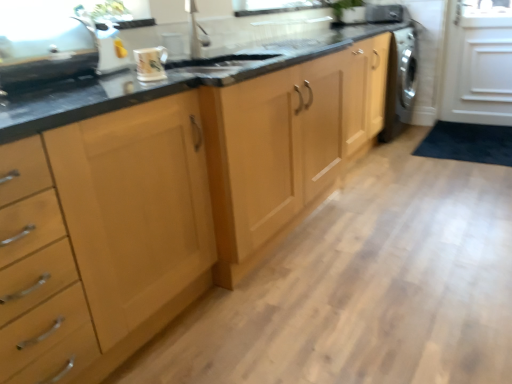
Measure the distance between satin silver dishwasher at right, which is counted as the 1th appliance, starting from the back, and camera.

satin silver dishwasher at right, which is counted as the 1th appliance, starting from the back, and camera are 3.54 meters apart from each other.

You are a GUI agent. You are given a task and a screenshot of the screen. Output one action in this format:
    pyautogui.click(x=<x>, y=<y>)
    Task: Click on the green leafy plant at upper center
    The image size is (512, 384).
    Given the screenshot: What is the action you would take?
    pyautogui.click(x=341, y=8)

What are the coordinates of `metallic silver kettle at upper left, placed as the 2th appliance when sorted from left to right` in the screenshot? It's located at (108, 48).

The width and height of the screenshot is (512, 384). Find the location of `satin silver dishwasher at right, which is counted as the 1th appliance, starting from the top`. satin silver dishwasher at right, which is counted as the 1th appliance, starting from the top is located at coordinates (384, 13).

Who is taller, metallic silver kettle at upper left, placed as the 2th appliance when sorted from left to right, or satin silver sink at upper left, which is the third appliance in right-to-left order?

metallic silver kettle at upper left, placed as the 2th appliance when sorted from left to right.

Where is `appliance lying on the left of metallic silver kettle at upper left, which is counted as the 2th appliance, starting from the back`? The height and width of the screenshot is (384, 512). appliance lying on the left of metallic silver kettle at upper left, which is counted as the 2th appliance, starting from the back is located at coordinates (46, 52).

From a real-world perspective, is metallic silver kettle at upper left, the 2th appliance in the bottom-to-top sequence, physically located above or below satin silver sink at upper left, placed as the third appliance when sorted from top to bottom?

metallic silver kettle at upper left, the 2th appliance in the bottom-to-top sequence, is above satin silver sink at upper left, placed as the third appliance when sorted from top to bottom.

Between metallic silver kettle at upper left, the 2th appliance in the top-to-bottom sequence, and satin silver sink at upper left, the 1th appliance when ordered from bottom to top, which one has larger size?

Bigger between the two is satin silver sink at upper left, the 1th appliance when ordered from bottom to top.

Are glossy ceramic mug at upper center and satin silver sink at upper left, which appears as the 1th appliance when viewed from the left, far apart?

No, there isn't a large distance between glossy ceramic mug at upper center and satin silver sink at upper left, which appears as the 1th appliance when viewed from the left.

Can you tell me how much glossy ceramic mug at upper center and satin silver sink at upper left, the 1th appliance when ordered from bottom to top, differ in facing direction?

The angular difference between glossy ceramic mug at upper center and satin silver sink at upper left, the 1th appliance when ordered from bottom to top, is 0.985 degrees.

From a real-world perspective, is glossy ceramic mug at upper center positioned above or below satin silver sink at upper left, which is the third appliance in right-to-left order?

In terms of real-world spatial position, glossy ceramic mug at upper center is below satin silver sink at upper left, which is the third appliance in right-to-left order.

Can you confirm if glossy ceramic mug at upper center is wider than satin silver sink at upper left, the 1th appliance when ordered from bottom to top?

Incorrect, the width of glossy ceramic mug at upper center does not surpass that of satin silver sink at upper left, the 1th appliance when ordered from bottom to top.

Which object is positioned more to the right, glossy ceramic mug at upper center or satin silver dishwasher at right, which is counted as the 1th appliance, starting from the top?

satin silver dishwasher at right, which is counted as the 1th appliance, starting from the top, is more to the right.

Is glossy ceramic mug at upper center looking in the opposite direction of satin silver dishwasher at right, which ranks as the 1th appliance in right-to-left order?

No, glossy ceramic mug at upper center is not facing the opposite direction of satin silver dishwasher at right, which ranks as the 1th appliance in right-to-left order.

Which is further, (158, 78) or (369, 8)?

The point (369, 8) is farther from the camera.

Between glossy ceramic mug at upper center and satin silver dishwasher at right, which is counted as the 1th appliance, starting from the top, which one has smaller size?

With smaller size is glossy ceramic mug at upper center.

Is satin silver sink at upper left, placed as the third appliance when sorted from top to bottom, aimed at green leafy plant at upper center?

No, satin silver sink at upper left, placed as the third appliance when sorted from top to bottom, is not facing towards green leafy plant at upper center.

From the picture: Can you tell me how much satin silver sink at upper left, the 1th appliance when ordered from bottom to top, and green leafy plant at upper center differ in facing direction?

The angle between the facing direction of satin silver sink at upper left, the 1th appliance when ordered from bottom to top, and the facing direction of green leafy plant at upper center is 41.6 degrees.

From a real-world perspective, is satin silver sink at upper left, the 1th appliance when ordered from bottom to top, beneath green leafy plant at upper center?

Incorrect, from a real-world perspective, satin silver sink at upper left, the 1th appliance when ordered from bottom to top, is higher than green leafy plant at upper center.

Considering the relative positions of satin silver sink at upper left, which appears as the 1th appliance when viewed from the left, and green leafy plant at upper center in the image provided, is satin silver sink at upper left, which appears as the 1th appliance when viewed from the left, to the left or to the right of green leafy plant at upper center?

Based on their positions, satin silver sink at upper left, which appears as the 1th appliance when viewed from the left, is located to the left of green leafy plant at upper center.

Which is more to the left, satin silver sink at upper left, placed as the third appliance when sorted from top to bottom, or glossy ceramic mug at upper center?

satin silver sink at upper left, placed as the third appliance when sorted from top to bottom, is more to the left.

Considering the relative sizes of satin silver sink at upper left, which appears as the 1th appliance when viewed from the left, and glossy ceramic mug at upper center in the image provided, is satin silver sink at upper left, which appears as the 1th appliance when viewed from the left, bigger than glossy ceramic mug at upper center?

Yes, satin silver sink at upper left, which appears as the 1th appliance when viewed from the left, is bigger than glossy ceramic mug at upper center.

Which object is more forward, satin silver sink at upper left, which appears as the 1th appliance when viewed from the left, or glossy ceramic mug at upper center?

satin silver sink at upper left, which appears as the 1th appliance when viewed from the left, is more forward.

Can you confirm if satin silver sink at upper left, which ranks as the first appliance in front-to-back order, is thinner than glossy ceramic mug at upper center?

No.

From the picture: Is metallic silver kettle at upper left, the 2th appliance in the top-to-bottom sequence, oriented away from green leafy plant at upper center?

No, green leafy plant at upper center is not at the back of metallic silver kettle at upper left, the 2th appliance in the top-to-bottom sequence.

Could you measure the distance between metallic silver kettle at upper left, the second appliance viewed from the front, and green leafy plant at upper center?

5.84 feet.

Is metallic silver kettle at upper left, the 2th appliance in the top-to-bottom sequence, positioned in front of green leafy plant at upper center?

Yes, the depth of metallic silver kettle at upper left, the 2th appliance in the top-to-bottom sequence, is less than that of green leafy plant at upper center.

From the image's perspective, is satin silver dishwasher at right, the 3th appliance viewed from the front, on metallic silver kettle at upper left, which is counted as the 2th appliance, starting from the back?

Yes, from the image's perspective, satin silver dishwasher at right, the 3th appliance viewed from the front, is above metallic silver kettle at upper left, which is counted as the 2th appliance, starting from the back.

Who is smaller, satin silver dishwasher at right, which is counted as the 3th appliance, starting from the bottom, or metallic silver kettle at upper left, the 2th appliance in the bottom-to-top sequence?

satin silver dishwasher at right, which is counted as the 3th appliance, starting from the bottom.

Measure the distance from satin silver dishwasher at right, which ranks as the 1th appliance in right-to-left order, to metallic silver kettle at upper left, the 2th appliance in the top-to-bottom sequence.

satin silver dishwasher at right, which ranks as the 1th appliance in right-to-left order, and metallic silver kettle at upper left, the 2th appliance in the top-to-bottom sequence, are 8.42 feet apart.

What's the angular difference between satin silver dishwasher at right, the 3th appliance viewed from the front, and metallic silver kettle at upper left, the 2th appliance in the bottom-to-top sequence,'s facing directions?

The angle between the facing direction of satin silver dishwasher at right, the 3th appliance viewed from the front, and the facing direction of metallic silver kettle at upper left, the 2th appliance in the bottom-to-top sequence, is 91.1 degrees.

Locate an element on the screen. appliance that is the 1st one when counting rightward from the satin silver sink at upper left, the 1th appliance when ordered from bottom to top is located at coordinates (108, 48).

Locate an element on the screen. appliance that is the 1st object located above the glossy ceramic mug at upper center (from the image's perspective) is located at coordinates coord(46,52).

When comparing their distances from satin silver dishwasher at right, which is counted as the 3th appliance, starting from the bottom, does green leafy plant at upper center or satin silver sink at upper left, the 1th appliance when ordered from bottom to top, seem further?

satin silver sink at upper left, the 1th appliance when ordered from bottom to top, is positioned further to the anchor satin silver dishwasher at right, which is counted as the 3th appliance, starting from the bottom.

Estimate the real-world distances between objects in this image. Which object is closer to metallic silver kettle at upper left, the second appliance viewed from the front, satin silver dishwasher at right, which is counted as the 1th appliance, starting from the back, or glossy ceramic mug at upper center?

glossy ceramic mug at upper center lies closer to metallic silver kettle at upper left, the second appliance viewed from the front, than the other object.

Which object lies nearer to the anchor point satin silver sink at upper left, which ranks as the first appliance in front-to-back order, glossy ceramic mug at upper center or green leafy plant at upper center?

glossy ceramic mug at upper center is closer to satin silver sink at upper left, which ranks as the first appliance in front-to-back order.

From the image, which object appears to be farther from satin silver dishwasher at right, which ranks as the 1th appliance in right-to-left order, metallic silver kettle at upper left, the second appliance viewed from the right, or satin silver sink at upper left, which is the third appliance in right-to-left order?

Among the two, satin silver sink at upper left, which is the third appliance in right-to-left order, is located further to satin silver dishwasher at right, which ranks as the 1th appliance in right-to-left order.

Looking at this image, when comparing their distances from green leafy plant at upper center, does satin silver sink at upper left, placed as the third appliance when sorted from top to bottom, or satin silver dishwasher at right, the 3th appliance viewed from the left, seem closer?

Based on the image, satin silver dishwasher at right, the 3th appliance viewed from the left, appears to be nearer to green leafy plant at upper center.

Based on their spatial positions, is satin silver dishwasher at right, which ranks as the 1th appliance in right-to-left order, or satin silver sink at upper left, arranged as the third appliance when viewed from the back, closer to green leafy plant at upper center?

Based on the image, satin silver dishwasher at right, which ranks as the 1th appliance in right-to-left order, appears to be nearer to green leafy plant at upper center.

Based on their spatial positions, is satin silver dishwasher at right, the 3th appliance viewed from the left, or glossy ceramic mug at upper center further from satin silver sink at upper left, the 1th appliance when ordered from bottom to top?

Based on the image, satin silver dishwasher at right, the 3th appliance viewed from the left, appears to be further to satin silver sink at upper left, the 1th appliance when ordered from bottom to top.

Based on their spatial positions, is satin silver dishwasher at right, the 3th appliance viewed from the front, or green leafy plant at upper center closer to metallic silver kettle at upper left, the second appliance viewed from the front?

Based on the image, green leafy plant at upper center appears to be nearer to metallic silver kettle at upper left, the second appliance viewed from the front.

Locate an element on the screen. This screenshot has width=512, height=384. appliance between metallic silver kettle at upper left, the second appliance viewed from the right, and green leafy plant at upper center in the front-back direction is located at coordinates (384, 13).

Locate an element on the screen. The width and height of the screenshot is (512, 384). kitchen appliance between satin silver sink at upper left, which appears as the 1th appliance when viewed from the left, and satin silver dishwasher at right, the 3th appliance viewed from the left, along the z-axis is located at coordinates (150, 63).

Find the location of a particular element. The width and height of the screenshot is (512, 384). kitchen appliance between satin silver sink at upper left, placed as the third appliance when sorted from top to bottom, and green leafy plant at upper center, along the z-axis is located at coordinates (150, 63).

This screenshot has height=384, width=512. Identify the location of appliance positioned between satin silver sink at upper left, the 1th appliance when ordered from bottom to top, and satin silver dishwasher at right, the 3th appliance viewed from the front, from near to far. (108, 48).